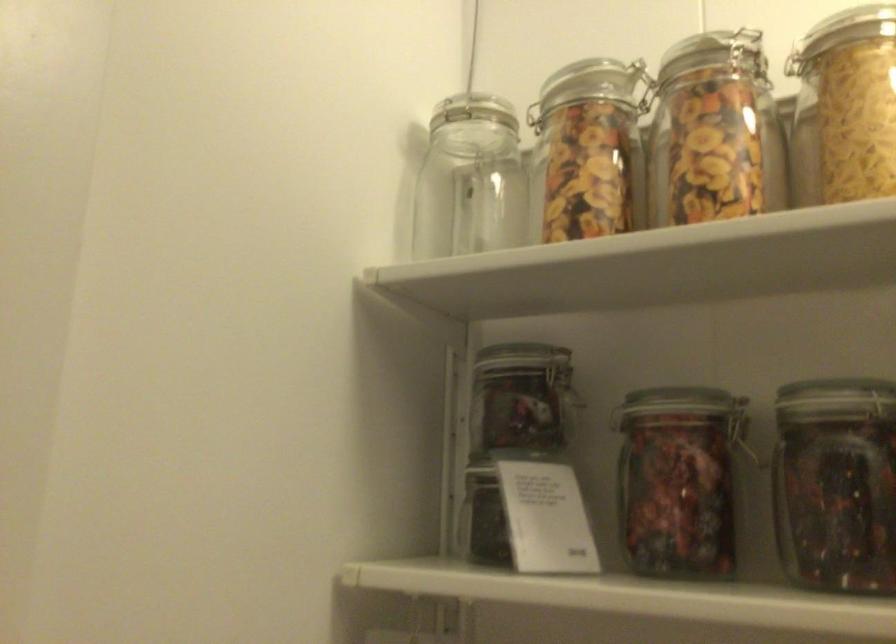
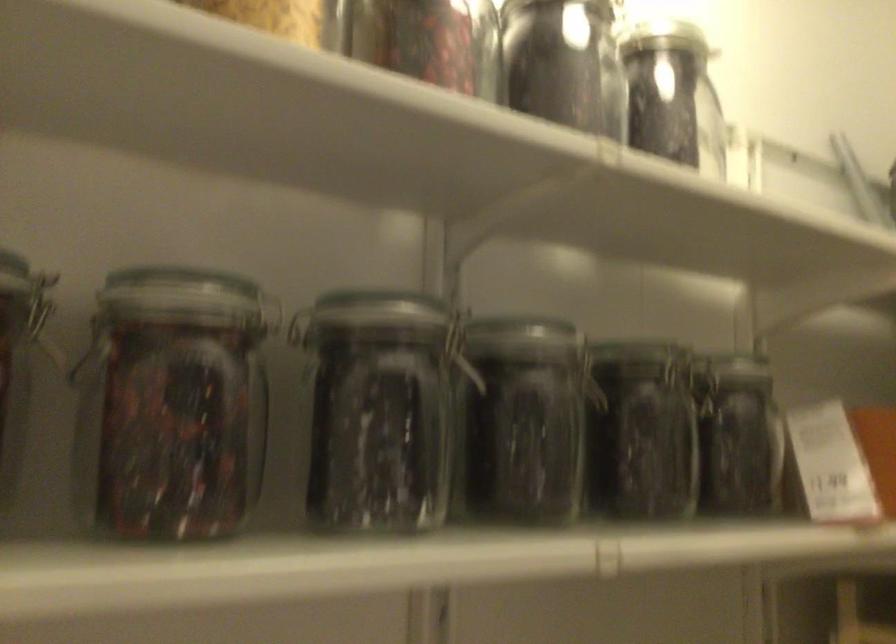
Where in the second image is the point corresponding to [822,482] from the first image?

(170, 406)